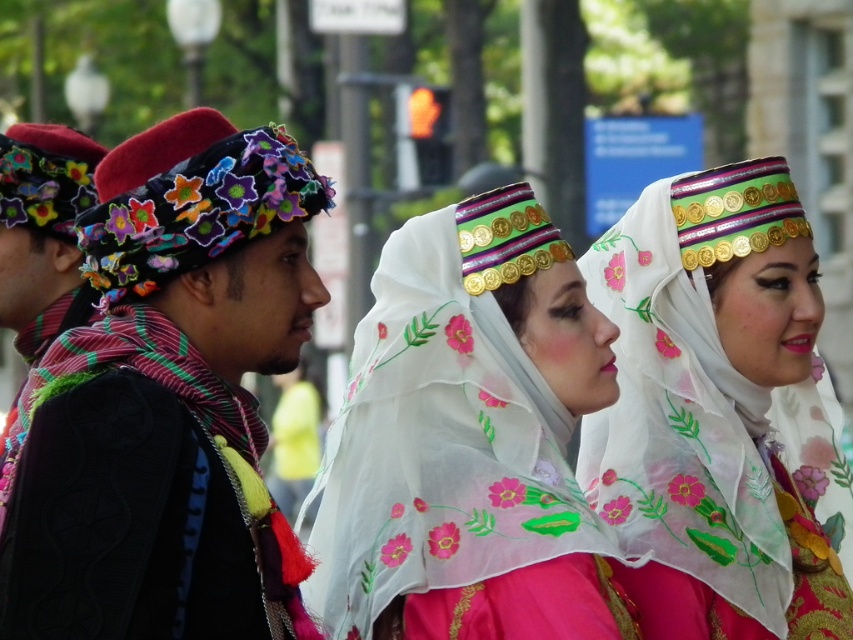
You are a photographer trying to capture the man in the image. The man is standing at point [167,404]. You need to adjust your camera to focus on him. Based on the scene description, where should you aim your camera to ensure he is in the frame?

The point [167,404] is on the multicolored fabric headband at left, so you should aim your camera towards the multicolored fabric headband at left to ensure the man is in the frame.

Looking at this image, you are a costume designer preparing for a performance. You have two accessories to place on a model. The multicolored fabric headband at left and the translucent floral veil at center. Which accessory should you choose if you want to cover more of the model head?

The multicolored fabric headband at left is wider than the translucent floral veil at center, so it would cover more of the model head.

Looking at this image, you are a photographer trying to capture the best angle of the scene. You notice two points marked in the image. Which point, point (421, 628) or point (683, 193), is closer to your camera lens?

Point (421, 628) is closer to the viewer than point (683, 193), so the photographer should focus on that point to ensure it appears larger and more detailed in the photo.